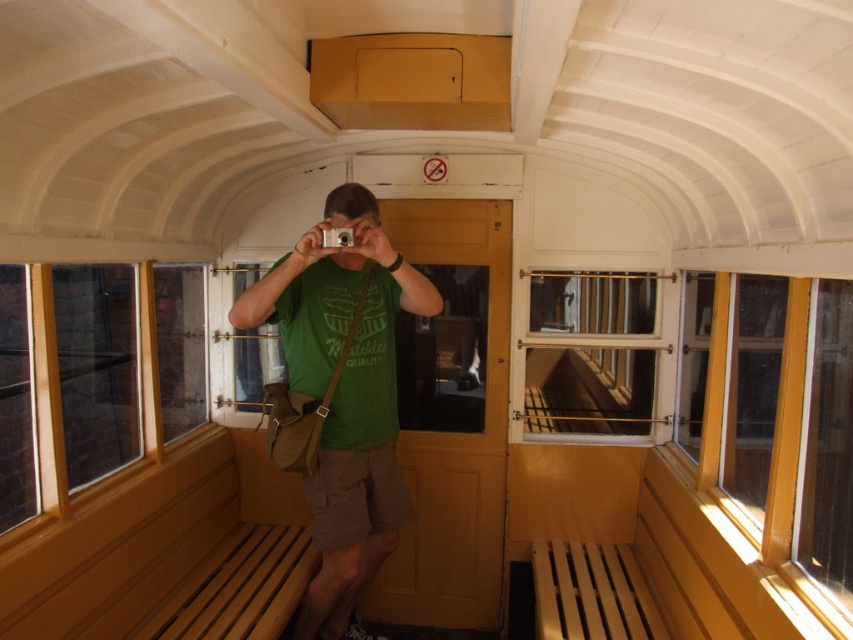
You are a photographer trying to capture the entire train car interior in one shot. The camera you are using has a limited field of view that can only capture objects within a 1.5 meter radius from your current position. Given that you are standing at point 0.5, 0.5, can you include the green fabric shirt at center in your photo?

The green fabric shirt at center is located at point (344,394), which is within the 1.5 meter radius from your position at (426,320). Therefore, you can include the green fabric shirt at center in your photo.

You are a photographer standing in the center of the vintage train car. You notice the green fabric shirt at center and the wooden slats at center. Which object is closer to the left side of the train car?

The green fabric shirt at center is positioned on the left side of wooden slats at center, so it is closer to the left side of the train car.

You are standing inside the vintage train car and want to take a photo of the two points mentioned. Which point is closer to you, point (277, 259) or point (566, 280)?

Point (277, 259) is closer to the viewer than point (566, 280).